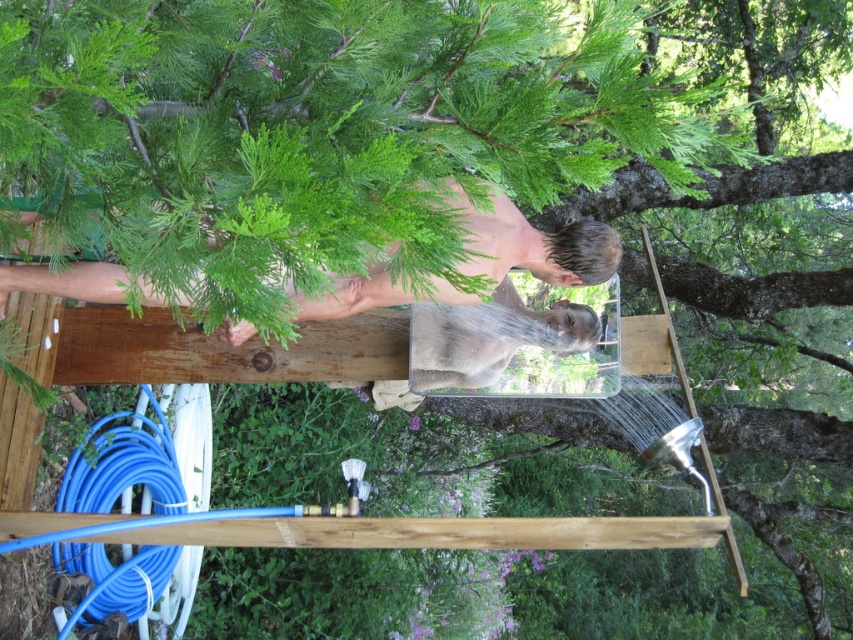
Question: Is brown wood beam at center smaller than blue rubber hose at lower left?

Choices:
 (A) no
 (B) yes

Answer: (B)

Question: Considering the real-world distances, which object is farthest from the brown wood beam at center?

Choices:
 (A) blue rubber hose at lower left
 (B) smooth skin man at center

Answer: (A)

Question: Is brown wood beam at center positioned before smooth skin man at center?

Choices:
 (A) no
 (B) yes

Answer: (A)

Question: Is brown wood beam at center positioned before smooth skin man at center?

Choices:
 (A) no
 (B) yes

Answer: (A)

Question: Which object is farther from the camera taking this photo?

Choices:
 (A) blue rubber hose at lower left
 (B) brown wood beam at center
 (C) smooth skin man at center

Answer: (A)

Question: Among these objects, which one is nearest to the camera?

Choices:
 (A) blue rubber hose at lower left
 (B) brown wood beam at center
 (C) smooth skin man at center

Answer: (C)